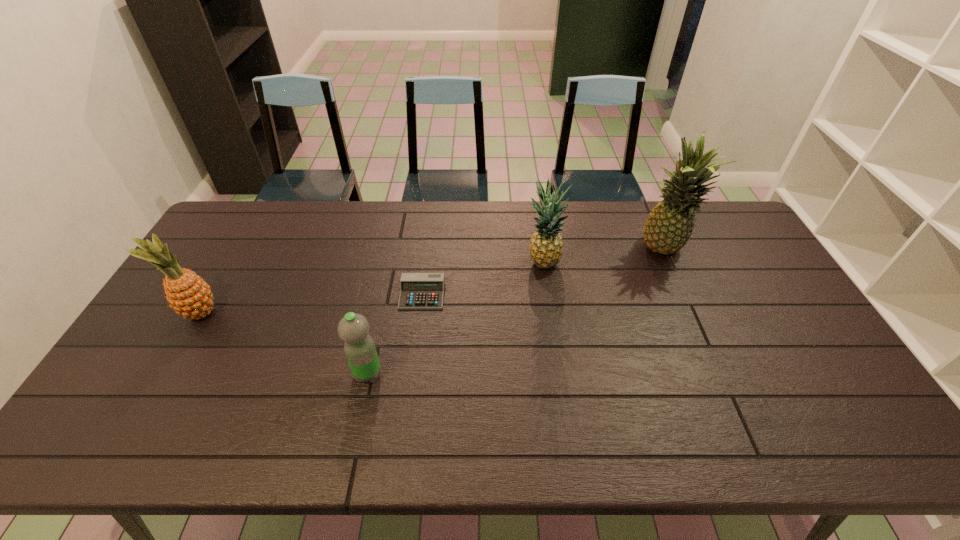
The width and height of the screenshot is (960, 540). Find the location of `vacant space at the near left corner`. vacant space at the near left corner is located at coordinates (89, 434).

Where is `free space at the far right corner of the desktop`? free space at the far right corner of the desktop is located at coordinates (701, 209).

Where is `vacant area that lies between the nearest object and the calculator`? Image resolution: width=960 pixels, height=540 pixels. vacant area that lies between the nearest object and the calculator is located at coordinates (395, 334).

Where is `vacant region between the leftmost object and the third object from right to left`? vacant region between the leftmost object and the third object from right to left is located at coordinates (311, 303).

At what (x,y) coordinates should I click in order to perform the action: click on empty space that is in between the leftmost pineapple and the second pineapple from left to right. Please return your answer as a coordinate pair (x, y). The image size is (960, 540). Looking at the image, I should click on (372, 288).

Image resolution: width=960 pixels, height=540 pixels. I want to click on free space between the second object from right to left and the calculator, so click(483, 279).

This screenshot has width=960, height=540. What are the coordinates of `free space that is in between the rightmost pineapple and the second pineapple from left to right` in the screenshot? It's located at (603, 257).

The width and height of the screenshot is (960, 540). Find the location of `free point between the second shortest object and the leftmost pineapple`. free point between the second shortest object and the leftmost pineapple is located at coordinates (284, 343).

Find the location of a particular element. This screenshot has height=540, width=960. vacant area between the fourth object from right to left and the second pineapple from left to right is located at coordinates (455, 319).

Locate an element on the screen. The width and height of the screenshot is (960, 540). free area in between the nearest pineapple and the second object from right to left is located at coordinates (372, 288).